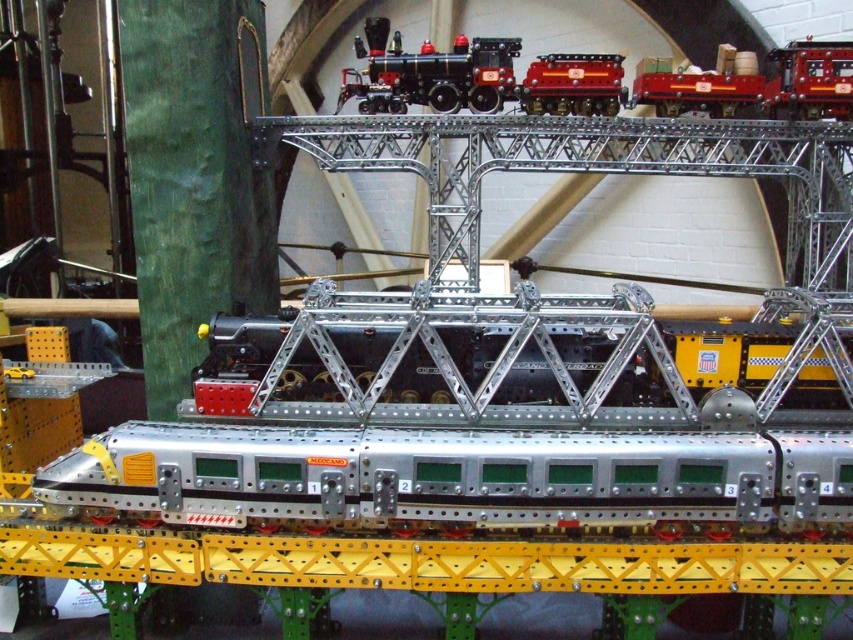
You are a model train enthusiast who wants to place a new train car between the silver metallic train at center and the shiny black locomotive at upper center. Based on their widths, can you determine if there is enough space for the new car?

The silver metallic train at center might be wider than shiny black locomotive at upper center, so there may not be enough space for the new car unless the existing trains are moved or the new car is smaller in width.

You are a model train enthusiast inspecting the layout. You notice a point marked at coordinate (456, 476). Which object is located at that point?

The point at coordinate (456, 476) marks the silver metallic train at center.

You are a toy collector who wants to know if the shiny black locomotive at upper center can be placed on a shelf that fits items up to the size of the shiny red metal train car at center. Based on their sizes, what would you advise?

The shiny black locomotive at upper center is bigger than the shiny red metal train car at center, so it won